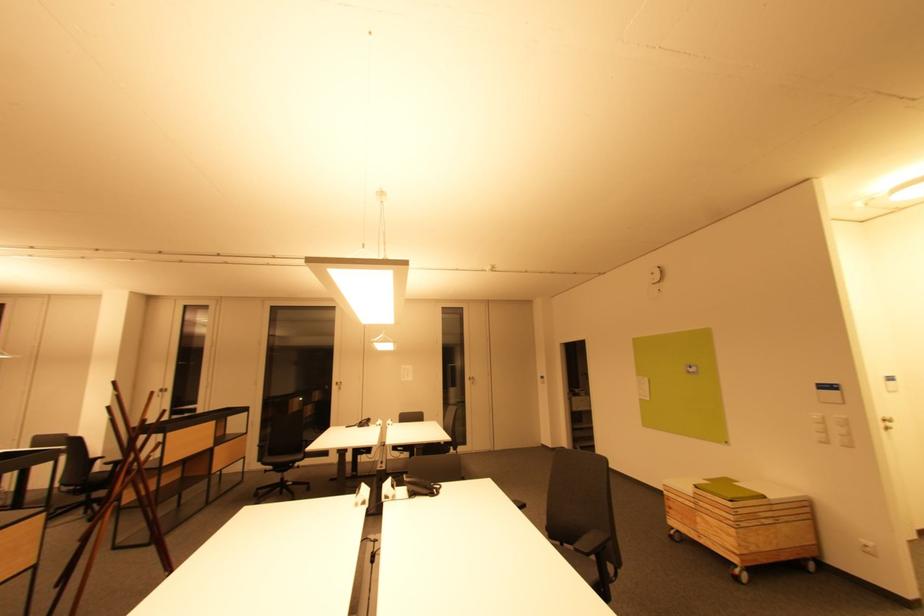
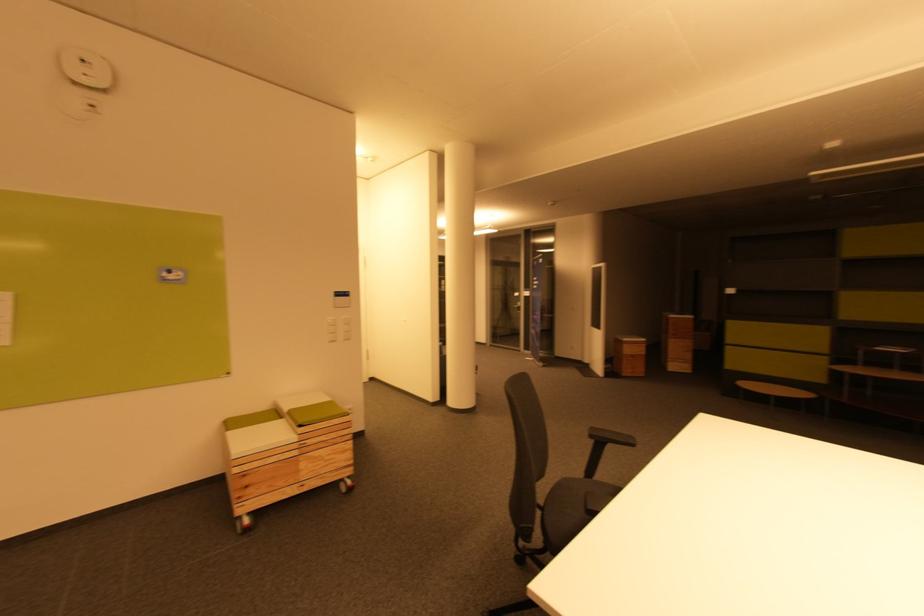
Where in the second image is the point corresponding to pixel 821 387 from the first image?

(342, 294)